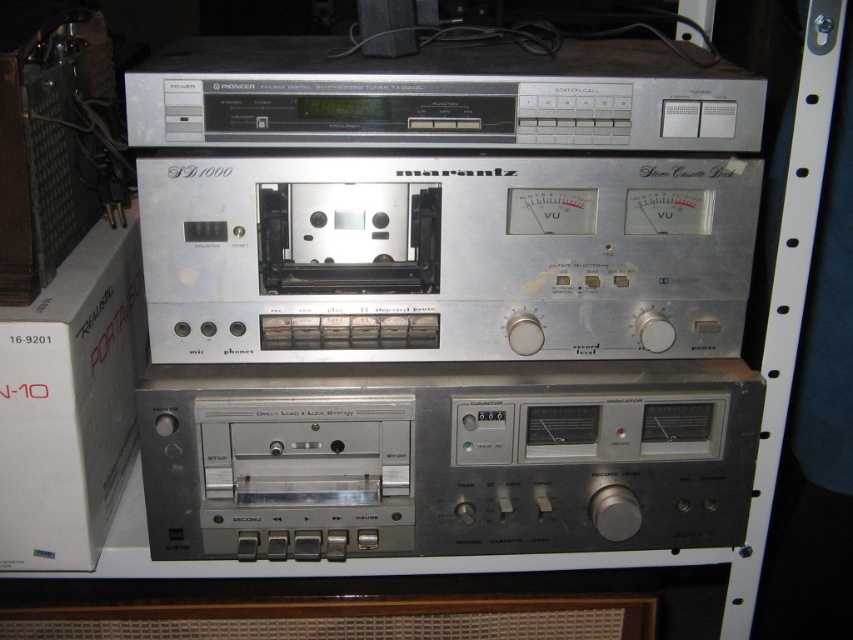
Question: Can you confirm if silver metallic cassette at center is wider than metallic silver cassette at center?

Choices:
 (A) no
 (B) yes

Answer: (A)

Question: Which object is closer to the camera taking this photo?

Choices:
 (A) metallic silver cassette at center
 (B) silver metallic cassette at center

Answer: (B)

Question: Which point appears farthest from the camera in this image?

Choices:
 (A) (541, 348)
 (B) (509, 534)

Answer: (B)

Question: Is silver metallic cassette at center below metallic silver cassette at center?

Choices:
 (A) yes
 (B) no

Answer: (B)

Question: Does silver metallic cassette at center appear over metallic silver cassette at center?

Choices:
 (A) no
 (B) yes

Answer: (B)

Question: Which point is closer to the camera?

Choices:
 (A) silver metallic cassette at center
 (B) metallic silver cassette at center

Answer: (A)